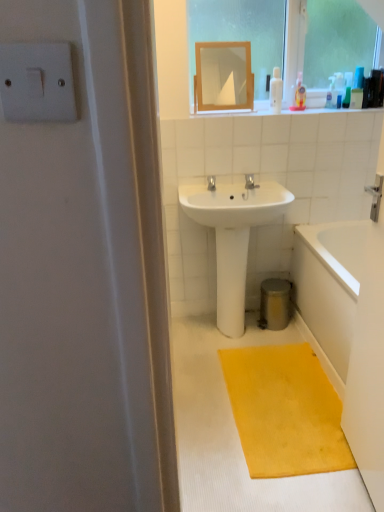
Describe the element at coordinates (240, 33) in the screenshot. I see `transparent glass mirror at upper center` at that location.

The height and width of the screenshot is (512, 384). In order to click on white ceramic sink at center in this screenshot , I will do `click(233, 236)`.

What is the approximate height of white ceramic sink at center?

white ceramic sink at center is 84.07 centimeters in height.

Describe the element at coordinates (331, 93) in the screenshot. The image size is (384, 512). I see `translucent plastic soap dispenser at upper right, which appears as the second toiletry when viewed from the left` at that location.

Describe the element at coordinates (285, 411) in the screenshot. I see `yellow textured mat at lower right` at that location.

Find the location of `white plastic light switch at upper left`. white plastic light switch at upper left is located at coordinates (37, 82).

In order to click on white plastic bottle at upper right, which is counted as the third toiletry, starting from the right in this screenshot , I will do `click(276, 90)`.

Is white plastic light switch at upper left facing away from translucent plastic bottle at upper right, placed as the first toiletry when sorted from right to left?

No, white plastic light switch at upper left is not facing away from translucent plastic bottle at upper right, placed as the first toiletry when sorted from right to left.

Considering the sizes of objects white plastic light switch at upper left and translucent plastic bottle at upper right, the 3th toiletry when ordered from left to right, in the image provided, who is smaller, white plastic light switch at upper left or translucent plastic bottle at upper right, the 3th toiletry when ordered from left to right,?

Smaller between the two is white plastic light switch at upper left.

Which object is wider, white plastic light switch at upper left or translucent plastic bottle at upper right, the 3th toiletry when ordered from left to right?

Wider between the two is translucent plastic bottle at upper right, the 3th toiletry when ordered from left to right.

Are white plastic light switch at upper left and translucent plastic bottle at upper right, the 3th toiletry when ordered from left to right, making contact?

No.

In terms of width, does transparent glass mirror at upper center look wider or thinner when compared to translucent plastic soap dispenser at upper right, which appears as the second toiletry when viewed from the left?

In the image, transparent glass mirror at upper center appears to be wider than translucent plastic soap dispenser at upper right, which appears as the second toiletry when viewed from the left.

In the scene shown: Who is shorter, transparent glass mirror at upper center or translucent plastic soap dispenser at upper right, which appears as the second toiletry when viewed from the left?

translucent plastic soap dispenser at upper right, which appears as the second toiletry when viewed from the left.

In order to click on the 1st toiletry counting from the right of the transparent glass mirror at upper center in this screenshot , I will do coord(331,93).

Which object is more forward, transparent glass mirror at upper center or translucent plastic soap dispenser at upper right, the second toiletry in the right-to-left sequence?

transparent glass mirror at upper center.

Is white glossy bathtub at lower right further to camera compared to yellow textured mat at lower right?

Yes, white glossy bathtub at lower right is behind yellow textured mat at lower right.

Is white glossy bathtub at lower right facing towards yellow textured mat at lower right?

Yes, white glossy bathtub at lower right is turned towards yellow textured mat at lower right.

Considering the relative sizes of white glossy bathtub at lower right and yellow textured mat at lower right in the image provided, is white glossy bathtub at lower right bigger than yellow textured mat at lower right?

Yes, white glossy bathtub at lower right is bigger than yellow textured mat at lower right.

Considering the points (347, 254) and (290, 402), which point is in front, point (347, 254) or point (290, 402)?

The point (290, 402) is in front.

Who is taller, white plastic bottle at upper right, which is counted as the third toiletry, starting from the right, or wooden frame mirror at upper center?

wooden frame mirror at upper center is taller.

Is white plastic bottle at upper right, the 1th toiletry positioned from the left, facing towards wooden frame mirror at upper center?

No, white plastic bottle at upper right, the 1th toiletry positioned from the left, is not aimed at wooden frame mirror at upper center.

Does point (270, 91) lie behind point (239, 90)?

No, (270, 91) is in front of (239, 90).

Locate an element on the screen. This screenshot has width=384, height=512. mirror on the left of white plastic bottle at upper right, the 1th toiletry positioned from the left is located at coordinates pyautogui.click(x=223, y=75).

From the image's perspective, who appears lower, white plastic bottle at upper right, the 1th toiletry positioned from the left, or yellow textured mat at lower right?

From the image's view, yellow textured mat at lower right is below.

Image resolution: width=384 pixels, height=512 pixels. Identify the location of doormat in front of the white plastic bottle at upper right, the 1th toiletry positioned from the left. (285, 411).

Is white plastic bottle at upper right, the 1th toiletry positioned from the left, situated inside yellow textured mat at lower right or outside?

white plastic bottle at upper right, the 1th toiletry positioned from the left, exists outside the volume of yellow textured mat at lower right.

Is white plastic bottle at upper right, which is counted as the third toiletry, starting from the right, behind yellow textured mat at lower right?

Yes, it is.

Identify the location of light switch located on the left of white plastic bottle at upper right, the 1th toiletry positioned from the left. (37, 82).

From a real-world perspective, is white plastic bottle at upper right, which is counted as the third toiletry, starting from the right, physically below white plastic light switch at upper left?

Correct, in the physical world, white plastic bottle at upper right, which is counted as the third toiletry, starting from the right, is lower than white plastic light switch at upper left.

Is white plastic bottle at upper right, the 1th toiletry positioned from the left, placed right next to white plastic light switch at upper left?

No, white plastic bottle at upper right, the 1th toiletry positioned from the left, is not making contact with white plastic light switch at upper left.

From the picture: How different are the orientations of white plastic bottle at upper right, the 1th toiletry positioned from the left, and white plastic light switch at upper left in degrees?

There is a 0.791-degree angle between the facing directions of white plastic bottle at upper right, the 1th toiletry positioned from the left, and white plastic light switch at upper left.

Is translucent plastic bottle at upper right, the 3th toiletry when ordered from left to right, positioned with its back to translucent plastic soap dispenser at upper right, which appears as the second toiletry when viewed from the left?

translucent plastic bottle at upper right, the 3th toiletry when ordered from left to right, does not have its back to translucent plastic soap dispenser at upper right, which appears as the second toiletry when viewed from the left.

Is translucent plastic bottle at upper right, placed as the first toiletry when sorted from right to left, wider or thinner than translucent plastic soap dispenser at upper right, which appears as the second toiletry when viewed from the left?

Considering their sizes, translucent plastic bottle at upper right, placed as the first toiletry when sorted from right to left, looks slimmer than translucent plastic soap dispenser at upper right, which appears as the second toiletry when viewed from the left.

Is translucent plastic bottle at upper right, placed as the first toiletry when sorted from right to left, next to translucent plastic soap dispenser at upper right, which appears as the second toiletry when viewed from the left?

No, translucent plastic bottle at upper right, placed as the first toiletry when sorted from right to left, is not with translucent plastic soap dispenser at upper right, which appears as the second toiletry when viewed from the left.

From the image's perspective, which is above, translucent plastic bottle at upper right, the 3th toiletry when ordered from left to right, or translucent plastic soap dispenser at upper right, which appears as the second toiletry when viewed from the left?

translucent plastic soap dispenser at upper right, which appears as the second toiletry when viewed from the left.

I want to click on light switch that appears below the translucent plastic bottle at upper right, placed as the first toiletry when sorted from right to left (from the image's perspective), so [37, 82].

In order to click on window screen on the left side of translucent plastic soap dispenser at upper right, the second toiletry in the right-to-left sequence in this screenshot , I will do `click(240, 33)`.

Looking at the image, which one is located further to transparent glass mirror at upper center, white ceramic sink at center or wooden frame mirror at upper center?

The object further to transparent glass mirror at upper center is wooden frame mirror at upper center.

Which object lies further to the anchor point yellow textured mat at lower right, white ceramic sink at center or white glossy bathtub at lower right?

white ceramic sink at center is positioned further to the anchor yellow textured mat at lower right.

Looking at this image, when comparing their distances from yellow textured mat at lower right, does white glossy bathtub at lower right or white plastic light switch at upper left seem closer?

white glossy bathtub at lower right is positioned closer to the anchor yellow textured mat at lower right.

Based on their spatial positions, is transparent glass mirror at upper center or translucent plastic soap dispenser at upper right, which appears as the second toiletry when viewed from the left, closer to white glossy bathtub at lower right?

translucent plastic soap dispenser at upper right, which appears as the second toiletry when viewed from the left, is closer to white glossy bathtub at lower right.

Based on their spatial positions, is translucent plastic bottle at upper right, the 3th toiletry when ordered from left to right, or translucent plastic soap dispenser at upper right, the second toiletry in the right-to-left sequence, closer to white plastic bottle at upper right, the 1th toiletry positioned from the left?

translucent plastic soap dispenser at upper right, the second toiletry in the right-to-left sequence, lies closer to white plastic bottle at upper right, the 1th toiletry positioned from the left, than the other object.

Looking at the image, which one is located further to translucent plastic bottle at upper right, placed as the first toiletry when sorted from right to left, yellow textured mat at lower right or white glossy bathtub at lower right?

yellow textured mat at lower right is positioned further to the anchor translucent plastic bottle at upper right, placed as the first toiletry when sorted from right to left.

Based on their spatial positions, is wooden frame mirror at upper center or yellow textured mat at lower right closer to white plastic light switch at upper left?

yellow textured mat at lower right is positioned closer to the anchor white plastic light switch at upper left.

Estimate the real-world distances between objects in this image. Which object is further from white plastic light switch at upper left, white plastic bottle at upper right, the 1th toiletry positioned from the left, or white ceramic sink at center?

white plastic bottle at upper right, the 1th toiletry positioned from the left, is positioned further to the anchor white plastic light switch at upper left.

The height and width of the screenshot is (512, 384). What are the coordinates of `toiletry between white plastic bottle at upper right, which is counted as the third toiletry, starting from the right, and translucent plastic bottle at upper right, the 3th toiletry when ordered from left to right` in the screenshot? It's located at (331, 93).

You are a GUI agent. You are given a task and a screenshot of the screen. Output one action in this format:
    pyautogui.click(x=<x>, y=<y>)
    Task: Click on the toiletry that lies between translucent plastic bottle at upper right, placed as the first toiletry when sorted from right to left, and yellow textured mat at lower right from top to bottom
    The height and width of the screenshot is (512, 384).
    Given the screenshot: What is the action you would take?
    pyautogui.click(x=276, y=90)

In order to click on sink that lies between translucent plastic bottle at upper right, the 3th toiletry when ordered from left to right, and yellow textured mat at lower right from top to bottom in this screenshot , I will do `click(233, 236)`.

Locate an element on the screen. This screenshot has width=384, height=512. mirror between transparent glass mirror at upper center and white ceramic sink at center from top to bottom is located at coordinates (223, 75).